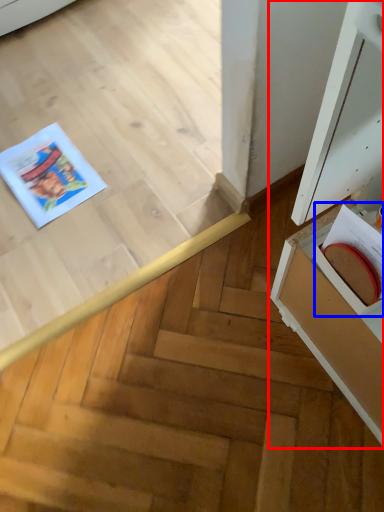
Question: Which of the following is the closest to the observer, cabinetry (highlighted by a red box) or book (highlighted by a blue box)?

Choices:
 (A) cabinetry
 (B) book

Answer: (A)